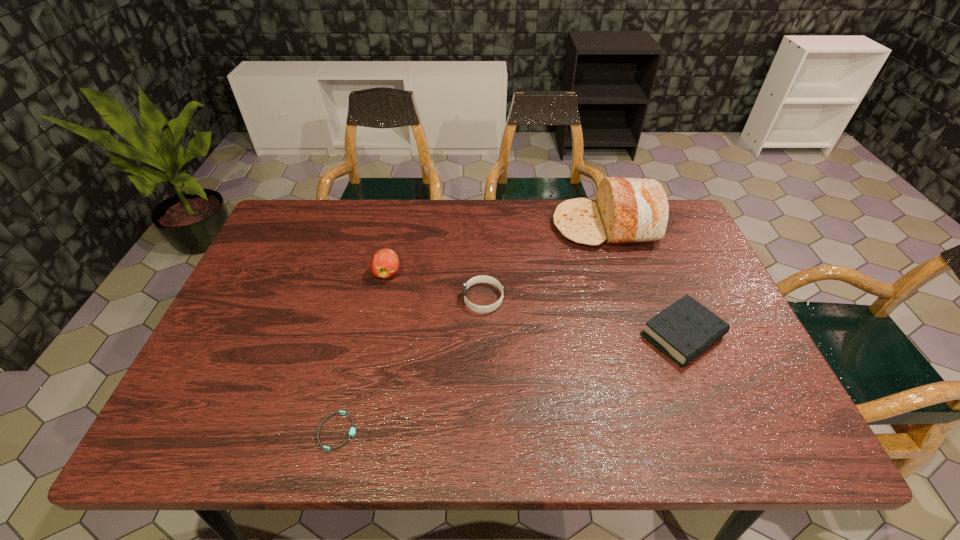
Where is `free point located 0.250m at the sliced end of the tallest object`? This screenshot has width=960, height=540. free point located 0.250m at the sliced end of the tallest object is located at coordinates (473, 226).

Locate an element on the screen. vacant space located 0.230m on the right of the fourth shortest object is located at coordinates (482, 273).

At what (x,y) coordinates should I click in order to perform the action: click on blank space located 0.390m on the back of the Bible. Please return your answer as a coordinate pair (x, y). Looking at the image, I should click on (634, 216).

You are a GUI agent. You are given a task and a screenshot of the screen. Output one action in this format:
    pyautogui.click(x=<x>, y=<y>)
    Task: Click on the vacant space positioned 0.050m on the outer surface of the third object from right to left
    This screenshot has width=960, height=540.
    Given the screenshot: What is the action you would take?
    pyautogui.click(x=444, y=299)

At what (x,y) coordinates should I click in order to perform the action: click on free space located on the outer surface of the third object from right to left. Please return your answer as a coordinate pair (x, y). The height and width of the screenshot is (540, 960). Looking at the image, I should click on (328, 299).

Find the location of a particular element. The image size is (960, 540). vacant space located 0.280m on the outer surface of the third object from right to left is located at coordinates (359, 299).

Locate an element on the screen. This screenshot has height=540, width=960. free space located on the buckle of the left wristband is located at coordinates (549, 431).

The height and width of the screenshot is (540, 960). Find the location of `object situated at the far edge`. object situated at the far edge is located at coordinates (627, 210).

Locate an element on the screen. The image size is (960, 540). object present at the near edge is located at coordinates (352, 431).

Locate an element on the screen. Image resolution: width=960 pixels, height=540 pixels. bread that is positioned at the right edge is located at coordinates (627, 210).